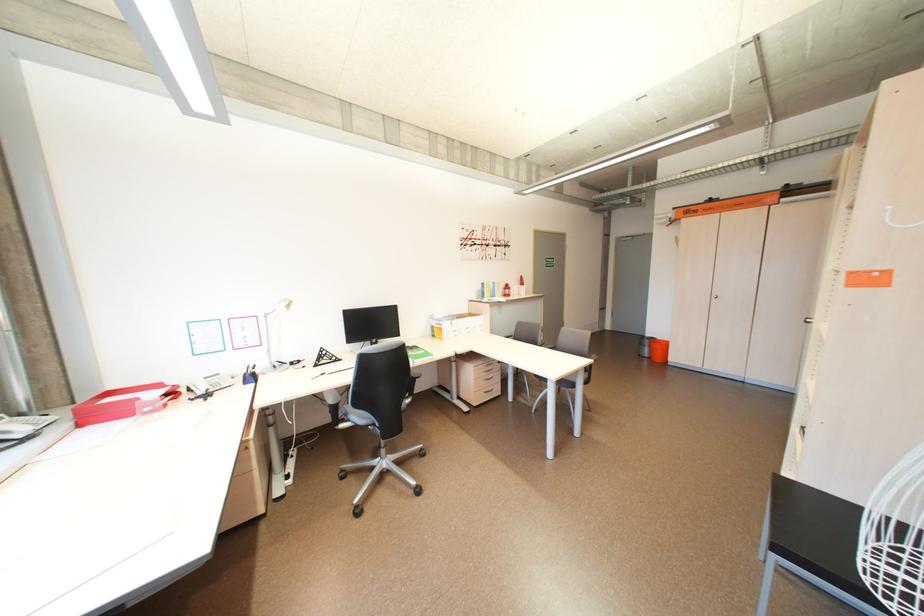
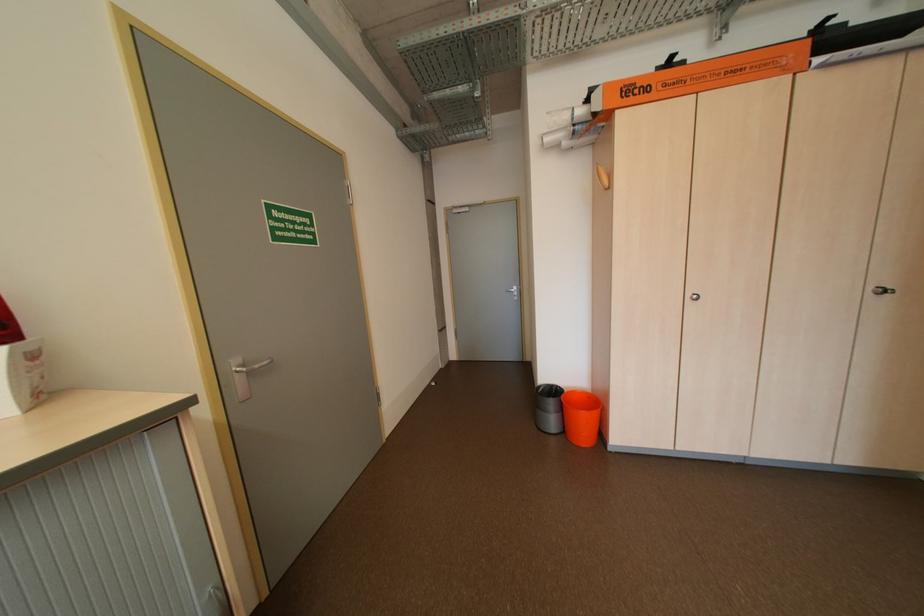
Locate, in the second image, the point that corresponds to point (706, 213) in the first image.

(655, 90)